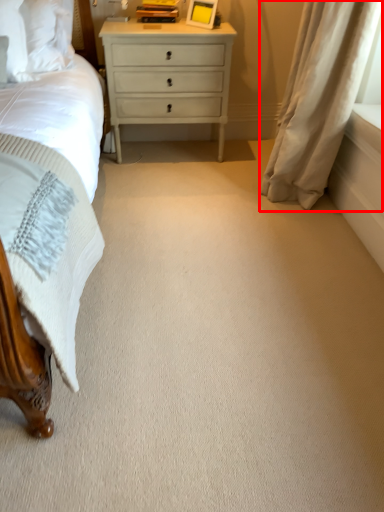
Question: Considering the relative positions of curtain (annotated by the red box) and nightstand in the image provided, where is curtain (annotated by the red box) located with respect to the staircase?

Choices:
 (A) right
 (B) left

Answer: (A)